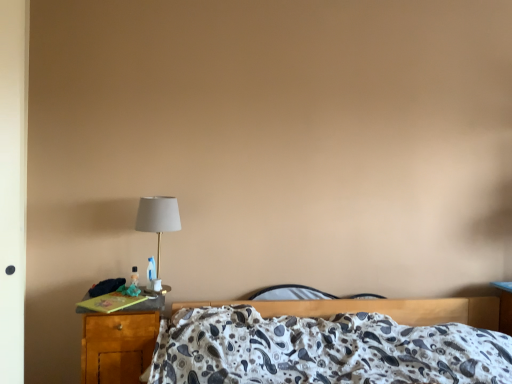
Question: From the image's perspective, is wooden nightstand at lower left on matte gold table lamp at left?

Choices:
 (A) yes
 (B) no

Answer: (B)

Question: Is the depth of wooden nightstand at lower left greater than that of matte gold table lamp at left?

Choices:
 (A) no
 (B) yes

Answer: (A)

Question: Is matte gold table lamp at left located within wooden nightstand at lower left?

Choices:
 (A) no
 (B) yes

Answer: (A)

Question: Is wooden nightstand at lower left shorter than matte gold table lamp at left?

Choices:
 (A) yes
 (B) no

Answer: (B)

Question: Does wooden nightstand at lower left have a smaller size compared to matte gold table lamp at left?

Choices:
 (A) no
 (B) yes

Answer: (A)

Question: Would you say matte gold table lamp at left is to the left or to the right of wooden nightstand at lower left in the picture?

Choices:
 (A) left
 (B) right

Answer: (B)

Question: Considering the positions of point (159, 236) and point (83, 327), is point (159, 236) closer or farther from the camera than point (83, 327)?

Choices:
 (A) farther
 (B) closer

Answer: (A)

Question: Is matte gold table lamp at left in front of or behind wooden nightstand at lower left in the image?

Choices:
 (A) front
 (B) behind

Answer: (B)

Question: Is matte gold table lamp at left situated inside wooden nightstand at lower left or outside?

Choices:
 (A) outside
 (B) inside

Answer: (A)

Question: Does point click(x=143, y=314) appear closer or farther from the camera than point click(x=264, y=372)?

Choices:
 (A) farther
 (B) closer

Answer: (A)

Question: From the image's perspective, is wooden nightstand at lower left above or below patterned fabric bed at center?

Choices:
 (A) above
 (B) below

Answer: (A)

Question: In terms of height, does wooden nightstand at lower left look taller or shorter compared to patterned fabric bed at center?

Choices:
 (A) tall
 (B) short

Answer: (B)

Question: Based on their sizes in the image, would you say wooden nightstand at lower left is bigger or smaller than patterned fabric bed at center?

Choices:
 (A) small
 (B) big

Answer: (A)

Question: From the image's perspective, is patterned fabric bed at center above or below wooden nightstand at lower left?

Choices:
 (A) above
 (B) below

Answer: (B)

Question: In terms of width, does patterned fabric bed at center look wider or thinner when compared to wooden nightstand at lower left?

Choices:
 (A) wide
 (B) thin

Answer: (A)